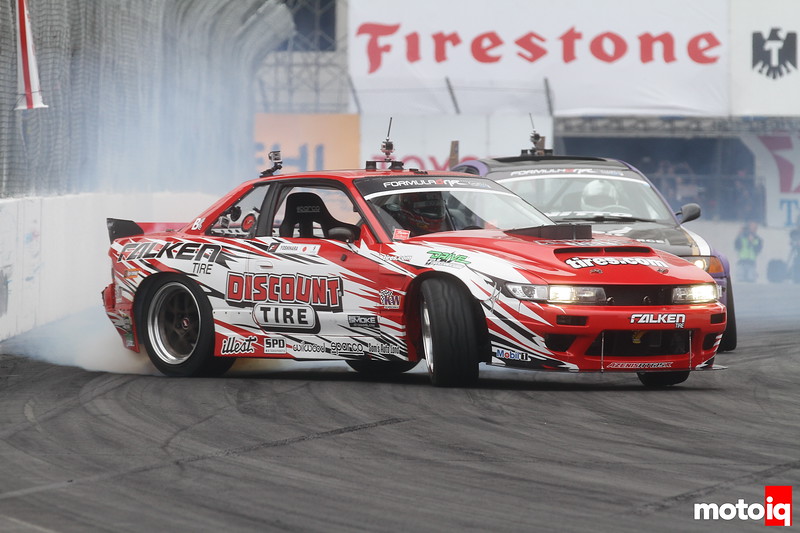
The width and height of the screenshot is (800, 533). Find the location of `white paint designs`. white paint designs is located at coordinates (286, 271), (705, 246), (462, 265), (141, 269), (333, 329).